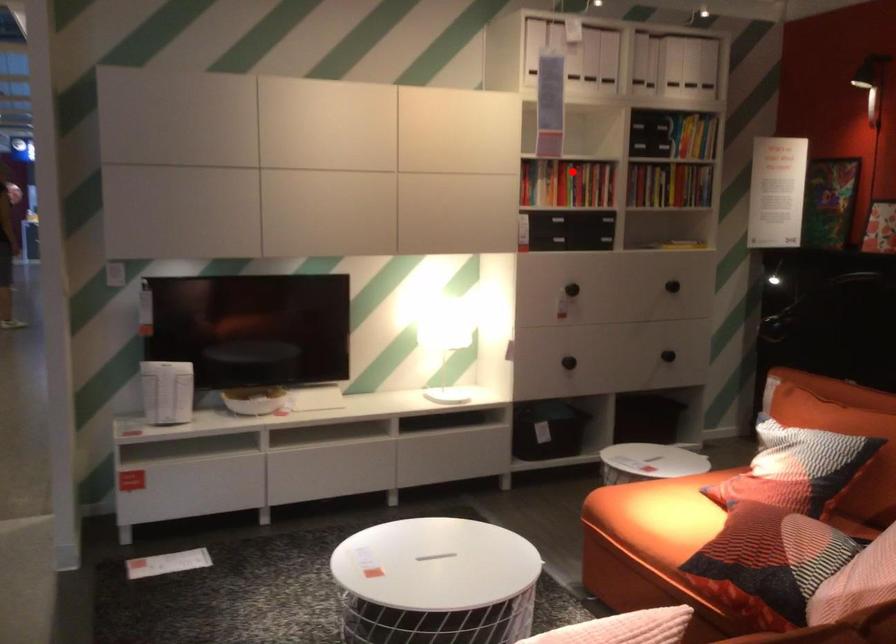
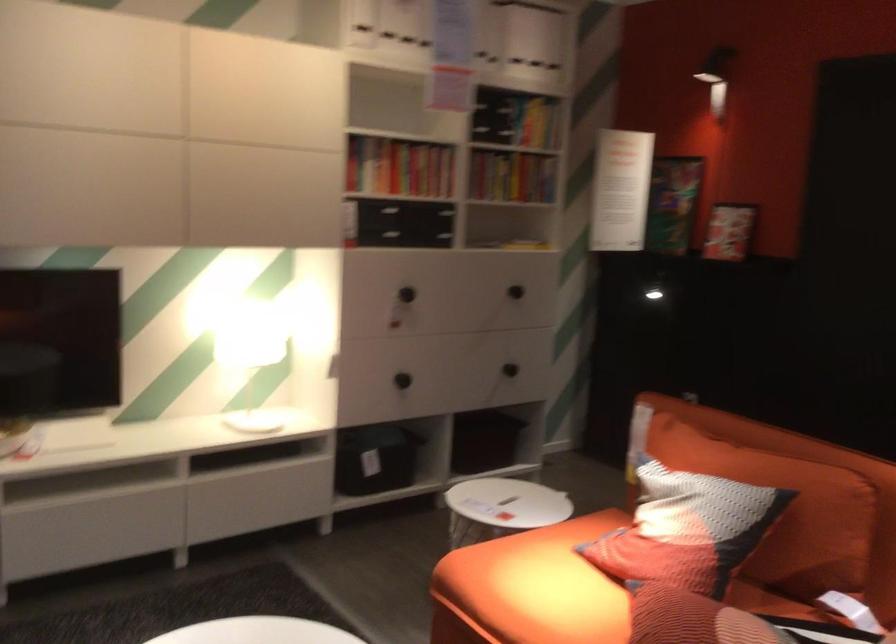
Question: A red point is marked in image1. In image2, is the corresponding 3D point closer to the camera or farther? Reply with the corresponding letter.

Choices:
 (A) The corresponding 3D point is closer.
 (B) The corresponding 3D point is farther.

Answer: (A)